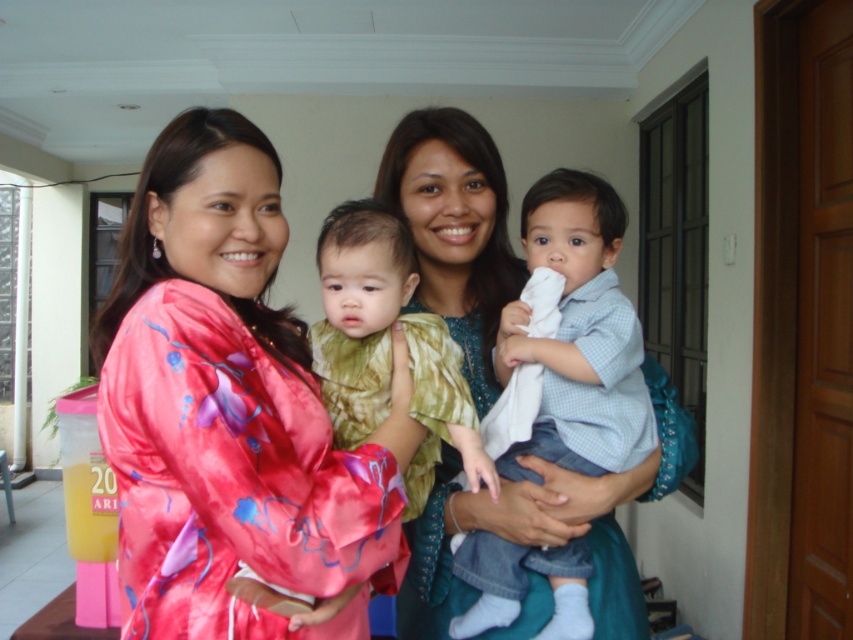
You are standing in the room and want to place a small plant on the light blue denim shirt at center. Is the shirt within your reach if you can reach up to 0.7 meters from the floor?

The light blue denim shirt at center is located at point (578, 336), which is within your reach since it is below 0.7 meters from the floor.

You are a photographer setting up for a family portrait. You need to position a microphone stand between the pink satin robe at left and the light blue denim shirt at center. The stand requires at least 12 inches of space to be placed. Can the microphone stand fit between them?

The distance between the pink satin robe at left and the light blue denim shirt at center is 14.46 inches, which is more than the required 12 inches. Therefore, the microphone stand can be placed between them.